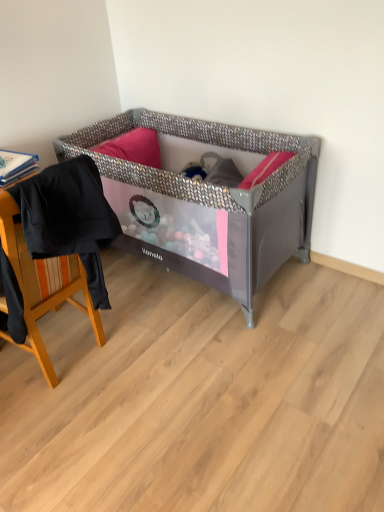
What are the coordinates of `black fabric chair at left` in the screenshot? It's located at coord(43,284).

This screenshot has width=384, height=512. What do you see at coordinates (43, 284) in the screenshot? I see `black fabric chair at left` at bounding box center [43, 284].

What is the approximate width of black fabric chair at left?

16.51 inches.

Looking at this image, in order to face black fabric chair at left, should I rotate leftwards or rightwards?

To align with it, rotate left about 22.234°.

Where is `metallic gray playpen at center`? This screenshot has height=512, width=384. metallic gray playpen at center is located at coordinates (209, 199).

Image resolution: width=384 pixels, height=512 pixels. Describe the element at coordinates (209, 199) in the screenshot. I see `metallic gray playpen at center` at that location.

Where is `black fabric chair at left`? This screenshot has width=384, height=512. black fabric chair at left is located at coordinates pos(43,284).

Does black fabric chair at left appear on the left side of metallic gray playpen at center?

Yes.

Is black fabric chair at left in front of or behind metallic gray playpen at center in the image?

Clearly, black fabric chair at left is in front of metallic gray playpen at center.

Between point (71, 302) and point (129, 169), which one is positioned behind?

The point (71, 302) is behind.

From the image's perspective, between black fabric chair at left and metallic gray playpen at center, which one is located above?

metallic gray playpen at center.

Based on the photo, from a real-world perspective, is black fabric chair at left below metallic gray playpen at center?

No, from a real-world perspective, black fabric chair at left is not below metallic gray playpen at center.

Considering the sizes of objects black fabric chair at left and metallic gray playpen at center in the image provided, who is wider, black fabric chair at left or metallic gray playpen at center?

metallic gray playpen at center.

Does black fabric chair at left have a lesser height compared to metallic gray playpen at center?

Yes.

Consider the image. Is black fabric chair at left bigger or smaller than metallic gray playpen at center?

black fabric chair at left is smaller than metallic gray playpen at center.

Is black fabric chair at left spatially inside metallic gray playpen at center, or outside of it?

black fabric chair at left is not enclosed by metallic gray playpen at center.

Is black fabric chair at left beside metallic gray playpen at center?

No, black fabric chair at left is not in contact with metallic gray playpen at center.

Is black fabric chair at left aimed at metallic gray playpen at center?

No, black fabric chair at left is not turned towards metallic gray playpen at center.

How many degrees apart are the facing directions of black fabric chair at left and metallic gray playpen at center?

85.4 degrees separate the facing orientations of black fabric chair at left and metallic gray playpen at center.

Find the location of `infant bed behind the black fabric chair at left`. infant bed behind the black fabric chair at left is located at coordinates (209, 199).

Would you say metallic gray playpen at center is to the left or to the right of black fabric chair at left in the picture?

Based on their positions, metallic gray playpen at center is located to the right of black fabric chair at left.

Based on the photo, is metallic gray playpen at center behind black fabric chair at left?

Yes, metallic gray playpen at center is further from the camera.

Is point (232, 177) positioned in front of point (39, 264)?

No, (232, 177) is behind (39, 264).

From the image's perspective, is metallic gray playpen at center positioned above or below black fabric chair at left?

metallic gray playpen at center is above black fabric chair at left.

From a real-world perspective, is metallic gray playpen at center over black fabric chair at left?

Incorrect, from a real-world perspective, metallic gray playpen at center is lower than black fabric chair at left.

From the picture: In terms of width, does metallic gray playpen at center look wider or thinner when compared to black fabric chair at left?

Considering their sizes, metallic gray playpen at center looks broader than black fabric chair at left.

Is metallic gray playpen at center shorter than black fabric chair at left?

No.

Which of these two, metallic gray playpen at center or black fabric chair at left, is bigger?

Bigger between the two is metallic gray playpen at center.

From the picture: Choose the correct answer: Is metallic gray playpen at center inside black fabric chair at left or outside it?

metallic gray playpen at center is outside black fabric chair at left.

Consider the image. Are metallic gray playpen at center and black fabric chair at left located far from each other?

No, there isn't a large distance between metallic gray playpen at center and black fabric chair at left.

Is metallic gray playpen at center oriented away from black fabric chair at left?

No, metallic gray playpen at center is not facing the opposite direction of black fabric chair at left.

This screenshot has height=512, width=384. Identify the location of chair on the left of metallic gray playpen at center. (43, 284).

In order to click on chair below the metallic gray playpen at center (from the image's perspective) in this screenshot , I will do `click(43, 284)`.

This screenshot has height=512, width=384. I want to click on infant bed behind the black fabric chair at left, so 209,199.